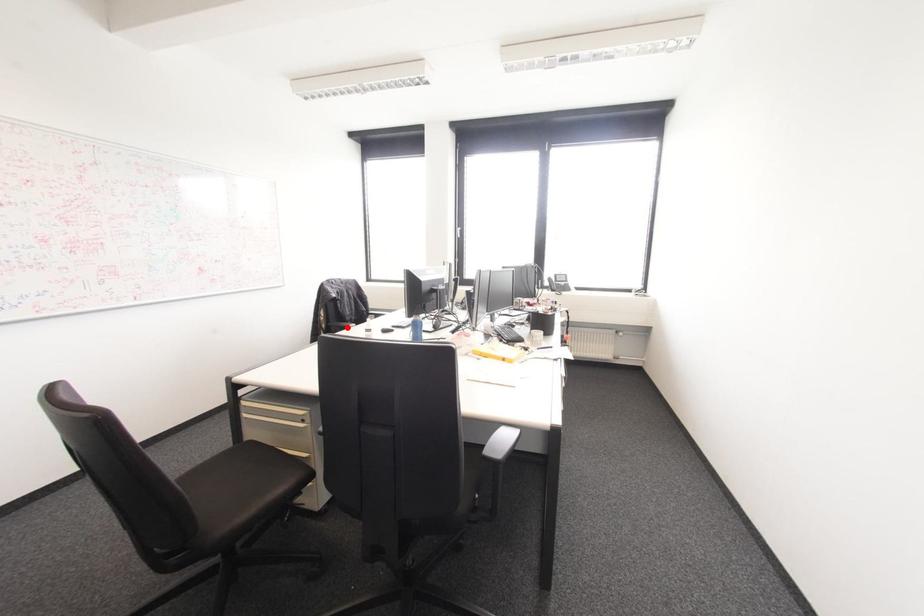
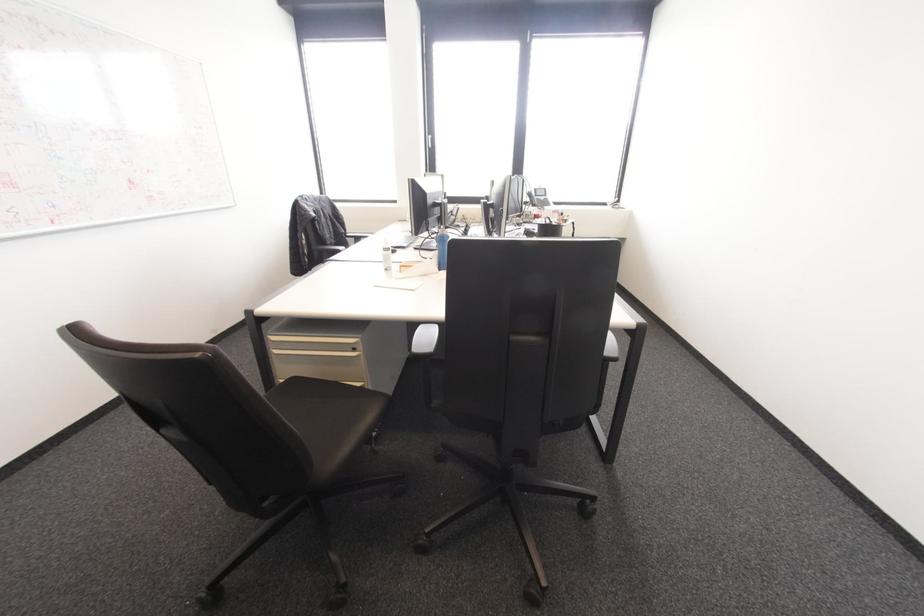
Question: I am providing you with two images of the same scene from different viewpoints. In image1, a red point is highlighted. Considering the same 3D point in image2, which of the following is correct?

Choices:
 (A) It is closer
 (B) It is farther

Answer: (A)